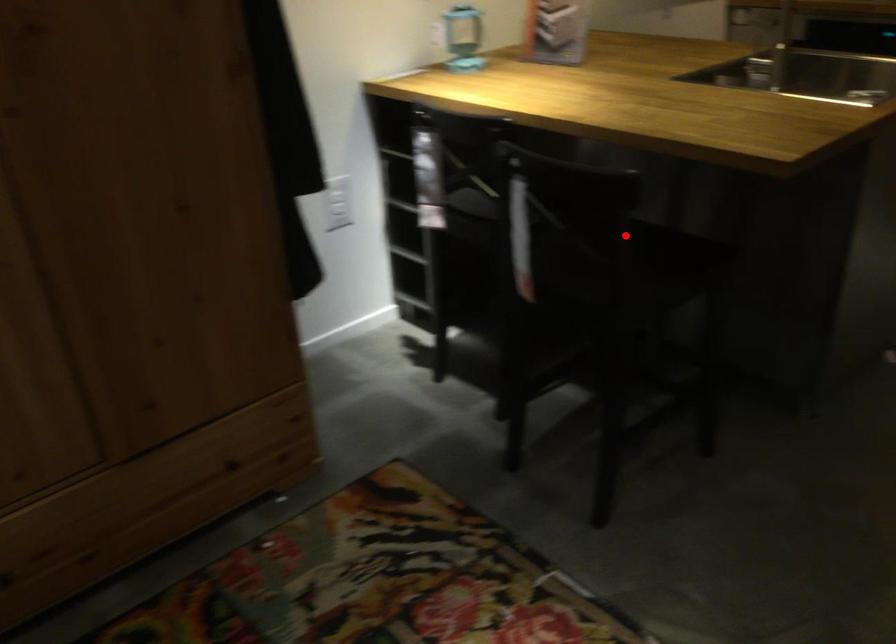
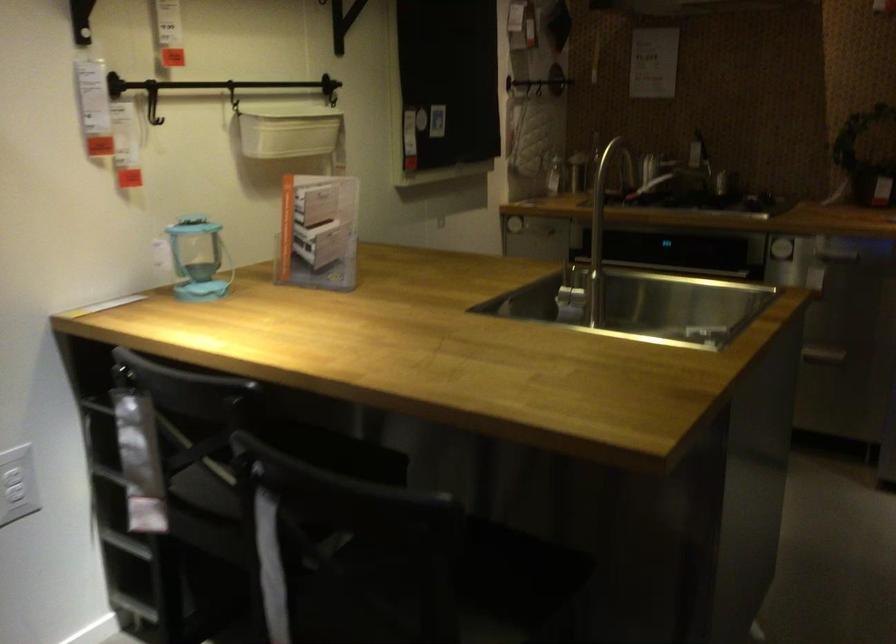
Question: A red point is marked in image1. In image2, is the corresponding 3D point closer to the camera or farther? Reply with the corresponding letter.

Choices:
 (A) The corresponding 3D point is closer.
 (B) The corresponding 3D point is farther.

Answer: (A)